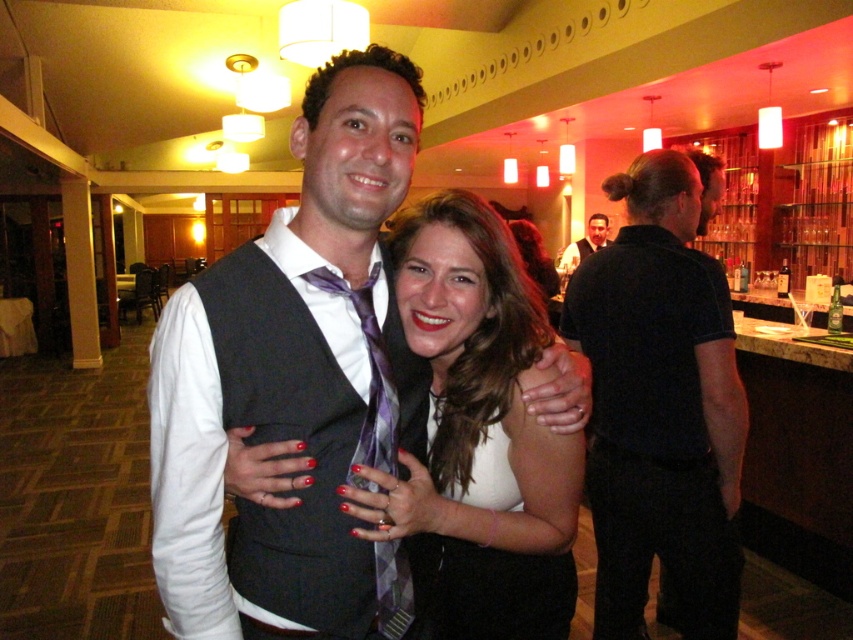
Question: Which point appears farthest from the camera in this image?

Choices:
 (A) (438, 346)
 (B) (370, 369)

Answer: (A)

Question: Does black smooth shirt at right have a larger size compared to dark gray vest at center?

Choices:
 (A) no
 (B) yes

Answer: (A)

Question: Can you confirm if white matte dress at center is positioned below dark gray vest at center?

Choices:
 (A) no
 (B) yes

Answer: (B)

Question: Which of the following is the closest to the observer?

Choices:
 (A) matte black dress at center
 (B) matte black vest at center
 (C) dark gray vest at center

Answer: (B)

Question: Does matte black vest at center have a lesser width compared to white matte dress at center?

Choices:
 (A) yes
 (B) no

Answer: (B)

Question: Which point is closer to the camera taking this photo?

Choices:
 (A) (596, 237)
 (B) (302, 100)
 (C) (439, 404)
 (D) (654, 452)

Answer: (B)